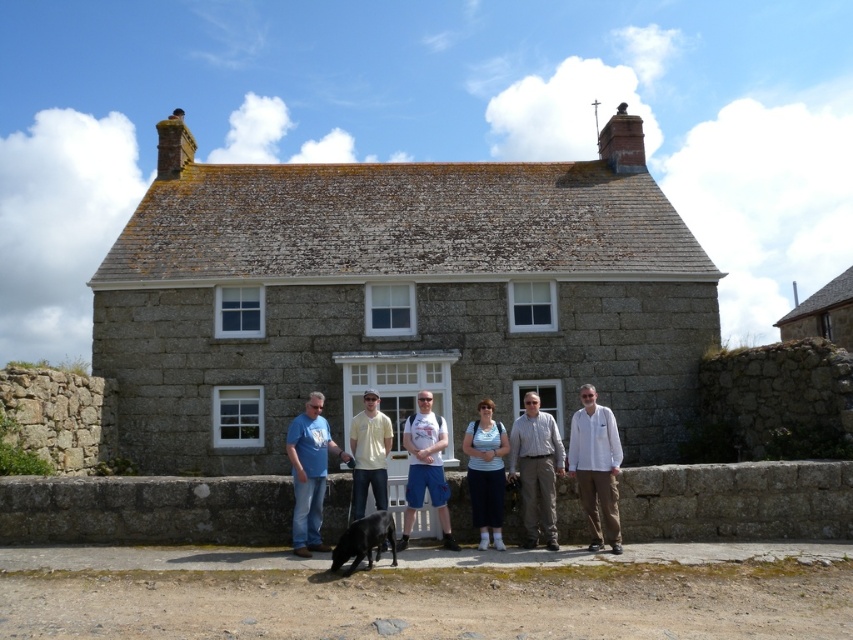
Question: Estimate the real-world distances between objects in this image. Which object is closer to the matte blue shirt at center?

Choices:
 (A) matte gray stone people at center
 (B) yellow matte shirt at center
 (C) matte blue t-shirt at center
 (D) white cotton shirt at center

Answer: (A)

Question: Is gray stone cottage at center above rustic stone cottage at upper right?

Choices:
 (A) no
 (B) yes

Answer: (B)

Question: Which point appears farthest from the camera in this image?

Choices:
 (A) (844, 305)
 (B) (596, 422)

Answer: (A)

Question: Considering the relative positions of matte blue shirt at center and yellow matte shirt at center in the image provided, where is matte blue shirt at center located with respect to yellow matte shirt at center?

Choices:
 (A) above
 (B) below

Answer: (B)

Question: Which of the following is the farthest from the observer?

Choices:
 (A) gray stone cottage at center
 (B) white cotton shirt at center
 (C) black fur dog at center
 (D) white cotton t-shirt at center

Answer: (A)

Question: Does gray stone cottage at center have a smaller size compared to rustic stone cottage at upper right?

Choices:
 (A) no
 (B) yes

Answer: (B)